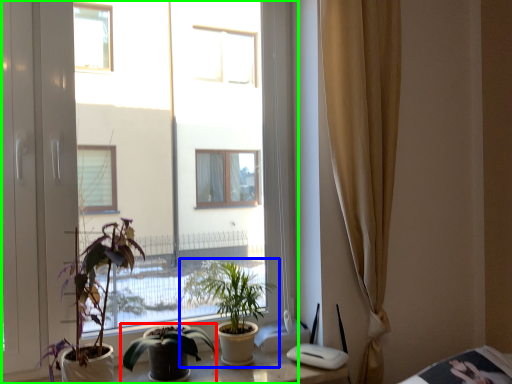
Question: Which is farther away from houseplant (highlighted by a red box)? houseplant (highlighted by a blue box) or window (highlighted by a green box)?

Choices:
 (A) houseplant
 (B) window

Answer: (B)